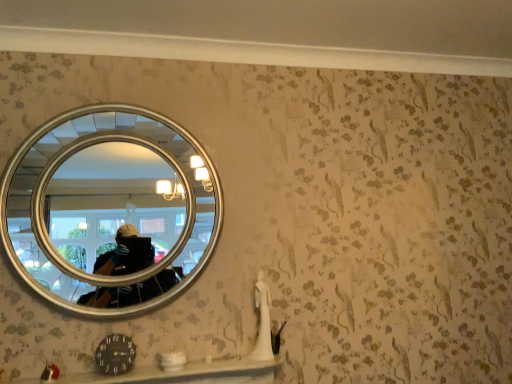
Question: Considering the relative sizes of silver/metallic mirror at upper left and smooth white ledge at lower center in the image provided, is silver/metallic mirror at upper left shorter than smooth white ledge at lower center?

Choices:
 (A) no
 (B) yes

Answer: (A)

Question: Does silver/metallic mirror at upper left lie in front of smooth white ledge at lower center?

Choices:
 (A) no
 (B) yes

Answer: (A)

Question: Can you confirm if silver/metallic mirror at upper left is thinner than smooth white ledge at lower center?

Choices:
 (A) yes
 (B) no

Answer: (A)

Question: Does silver/metallic mirror at upper left appear on the right side of smooth white ledge at lower center?

Choices:
 (A) yes
 (B) no

Answer: (B)

Question: Does silver/metallic mirror at upper left appear on the left side of smooth white ledge at lower center?

Choices:
 (A) yes
 (B) no

Answer: (A)

Question: Is silver/metallic mirror at upper left positioned beyond the bounds of smooth white ledge at lower center?

Choices:
 (A) yes
 (B) no

Answer: (A)

Question: Can you confirm if smooth white ledge at lower center is wider than silver/metallic mirror at upper left?

Choices:
 (A) yes
 (B) no

Answer: (A)

Question: From a real-world perspective, does smooth white ledge at lower center stand above silver/metallic mirror at upper left?

Choices:
 (A) yes
 (B) no

Answer: (B)

Question: Considering the relative sizes of smooth white ledge at lower center and silver/metallic mirror at upper left in the image provided, is smooth white ledge at lower center thinner than silver/metallic mirror at upper left?

Choices:
 (A) yes
 (B) no

Answer: (B)

Question: From a real-world perspective, is smooth white ledge at lower center physically below silver/metallic mirror at upper left?

Choices:
 (A) yes
 (B) no

Answer: (A)

Question: Does smooth white ledge at lower center have a greater height compared to silver/metallic mirror at upper left?

Choices:
 (A) no
 (B) yes

Answer: (A)

Question: From the image's perspective, does smooth white ledge at lower center appear lower than silver/metallic mirror at upper left?

Choices:
 (A) no
 (B) yes

Answer: (B)

Question: Looking at their shapes, would you say silver/metallic mirror at upper left is wider or thinner than smooth white ledge at lower center?

Choices:
 (A) thin
 (B) wide

Answer: (A)